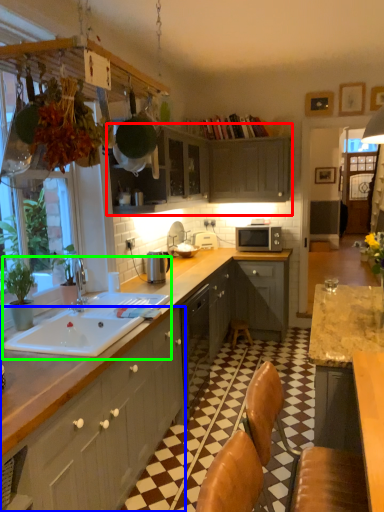
Question: Which object is the farthest from cabinetry (highlighted by a red box)? Choose among these: cabinetry (highlighted by a blue box) or sink (highlighted by a green box).

Choices:
 (A) cabinetry
 (B) sink

Answer: (A)